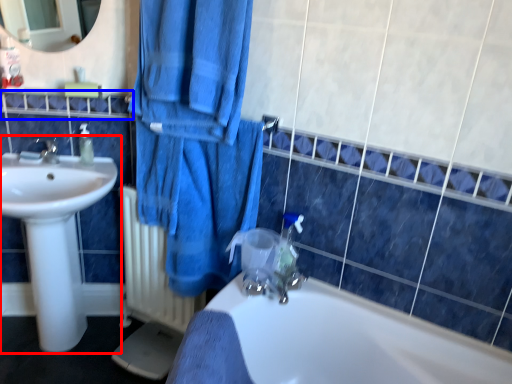
Question: Which of the following is the closest to the observer, sink (highlighted by a red box) or balustrade (highlighted by a blue box)?

Choices:
 (A) sink
 (B) balustrade

Answer: (A)